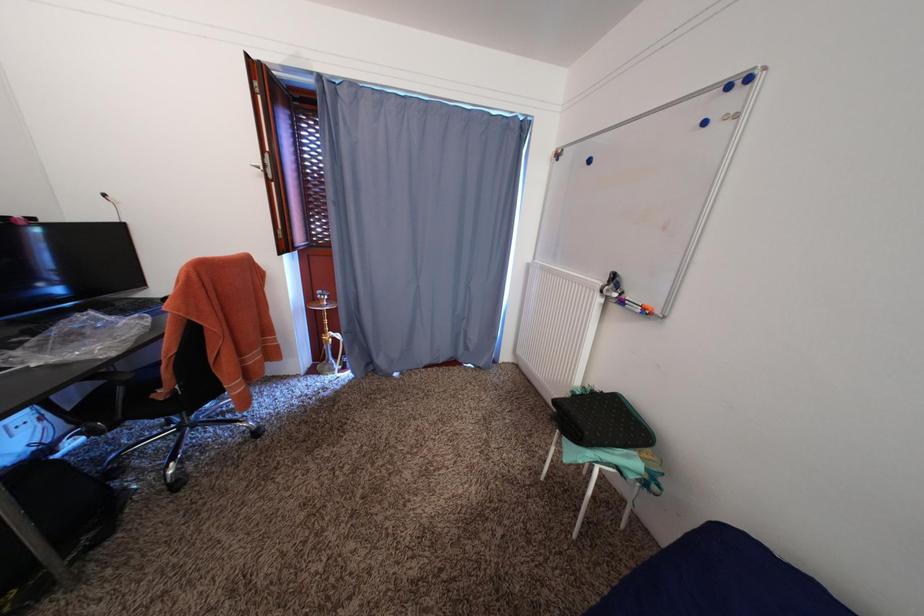
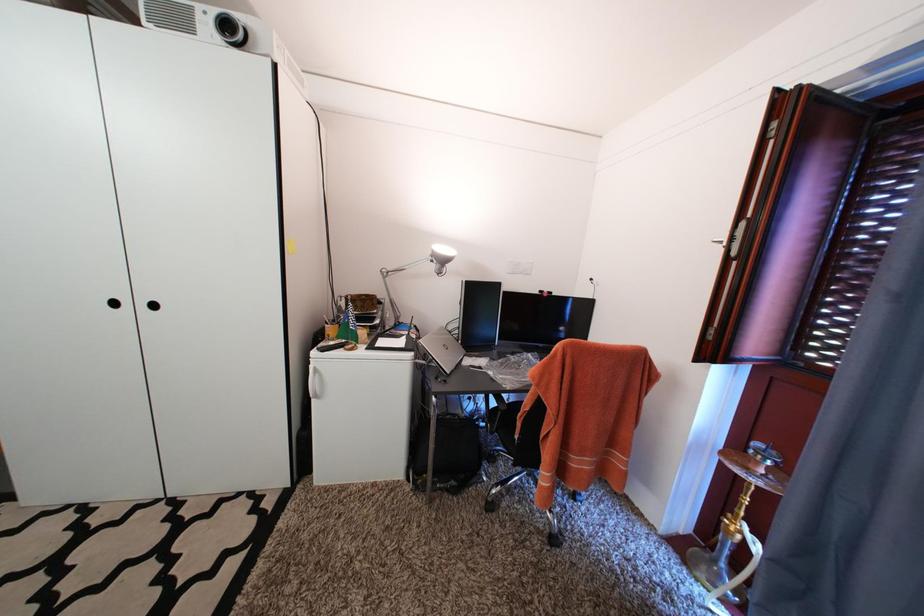
Question: The camera is either moving clockwise (left) or counter-clockwise (right) around the object. The first image is from the beginning of the video and the second image is from the end. Is the camera moving left or right when shooting the video?

Choices:
 (A) Left
 (B) Right

Answer: (B)